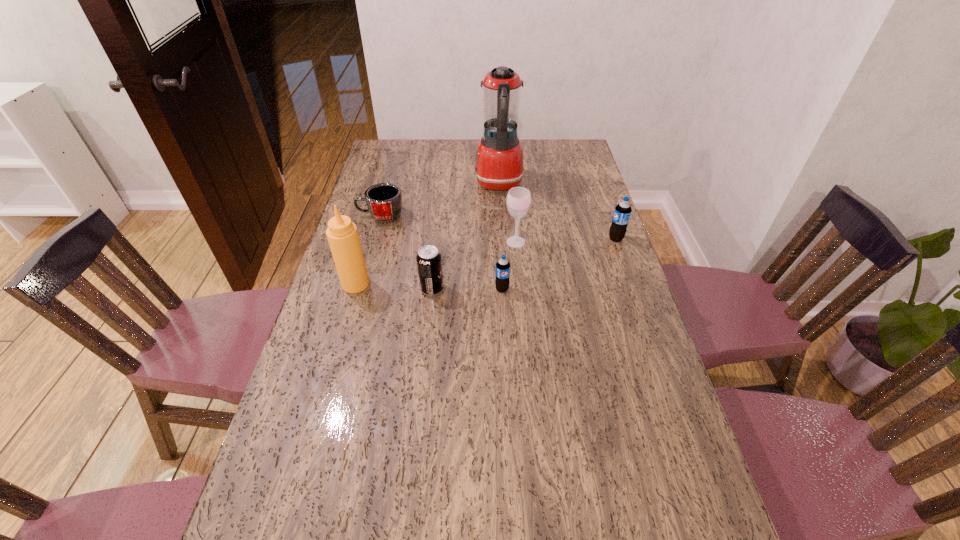
Find the location of a particular element. The height and width of the screenshot is (540, 960). free region located 0.300m on the front of the second soda can from left to right is located at coordinates (507, 383).

At what (x,y) coordinates should I click in order to perform the action: click on free space located 0.070m on the left of the rightmost object. Please return your answer as a coordinate pair (x, y). The width and height of the screenshot is (960, 540). Looking at the image, I should click on (587, 239).

At what (x,y) coordinates should I click in order to perform the action: click on vacant space situated 0.120m on the controls of the farthest object. Please return your answer as a coordinate pair (x, y). This screenshot has width=960, height=540. Looking at the image, I should click on (444, 184).

The width and height of the screenshot is (960, 540). Find the location of `free space located 0.070m on the controls of the farthest object`. free space located 0.070m on the controls of the farthest object is located at coordinates (456, 184).

Identify the location of vacant area located 0.230m on the controls of the farthest object. (416, 184).

Locate an element on the screen. vacant region located 0.100m on the back of the condiment is located at coordinates (365, 253).

Locate an element on the screen. The height and width of the screenshot is (540, 960). free region located 0.250m on the right of the leftmost soda can is located at coordinates (528, 289).

At what (x,y) coordinates should I click in order to perform the action: click on free space located 0.380m on the left of the third tallest object. Please return your answer as a coordinate pair (x, y). Looking at the image, I should click on (390, 242).

The width and height of the screenshot is (960, 540). What are the coordinates of `condiment that is positioned at the left edge` in the screenshot? It's located at (342, 233).

The width and height of the screenshot is (960, 540). I want to click on mug at the left edge, so click(384, 200).